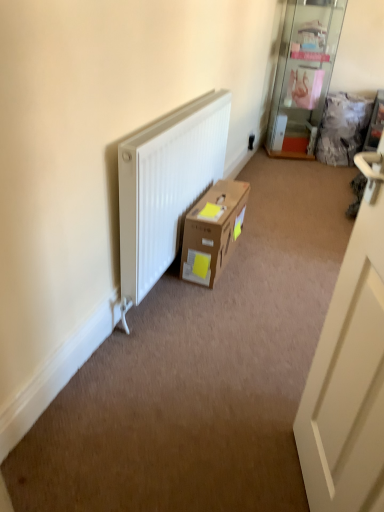
Locate an element on the screen. This screenshot has height=512, width=384. vacant space to the right of brown cardboard box at center is located at coordinates (264, 263).